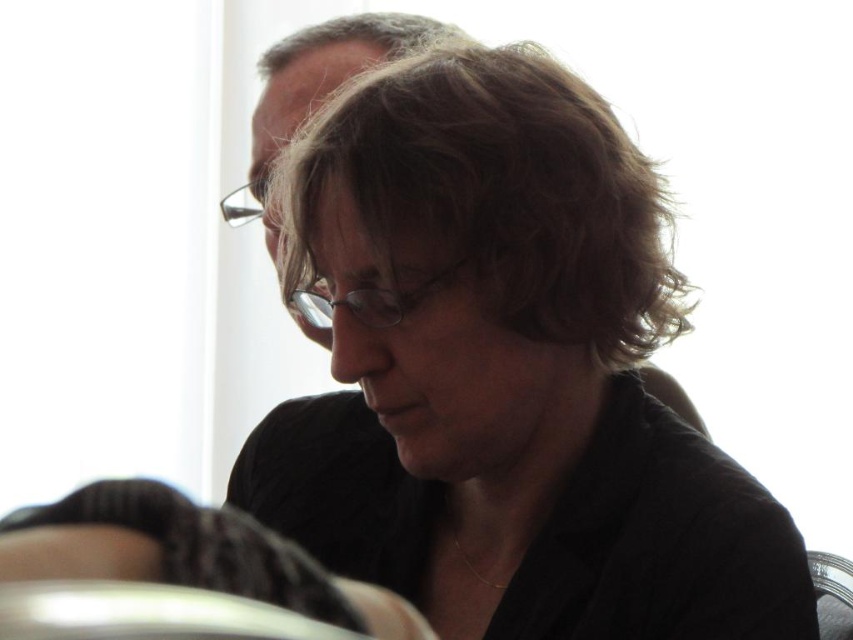
Question: Is matte black shirt at center above clear plastic glasses at center?

Choices:
 (A) yes
 (B) no

Answer: (B)

Question: Estimate the real-world distances between objects in this image. Which object is farther from the brown matte hair at center?

Choices:
 (A) clear plastic glasses at upper center
 (B) clear plastic glasses at center

Answer: (A)

Question: Estimate the real-world distances between objects in this image. Which object is closer to the clear plastic glasses at center?

Choices:
 (A) clear plastic glasses at upper center
 (B) matte black shirt at center
 (C) brown matte hair at center

Answer: (C)

Question: Can you confirm if matte black shirt at center is positioned above clear plastic glasses at upper center?

Choices:
 (A) no
 (B) yes

Answer: (A)

Question: Which object is farther from the camera taking this photo?

Choices:
 (A) clear plastic glasses at center
 (B) brown matte hair at center
 (C) matte black shirt at center
 (D) clear plastic glasses at upper center

Answer: (D)

Question: From the image, what is the correct spatial relationship of clear plastic glasses at center in relation to clear plastic glasses at upper center?

Choices:
 (A) below
 (B) above

Answer: (A)